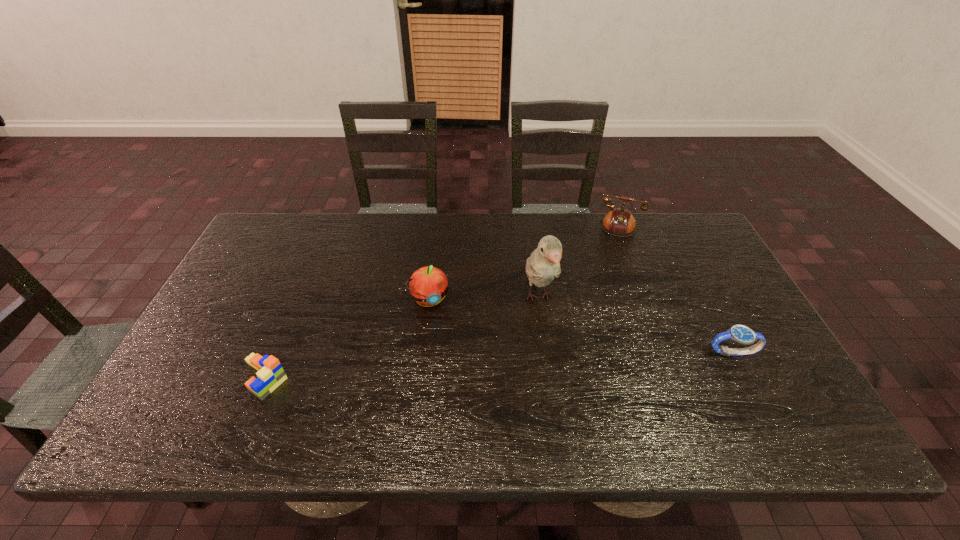
I want to click on free space on the desktop that is between the Lego and the rightmost object and is positioned at the face of the third object from left to right, so click(x=561, y=361).

Locate an element on the screen. free space on the desktop that is between the Lego and the watch and is positioned on the surface of the second object from left to right is located at coordinates (455, 367).

I want to click on vacant spot on the desktop that is between the leftmost object and the watch and is positioned on the rotary dial of the fourth object from left to right, so click(562, 361).